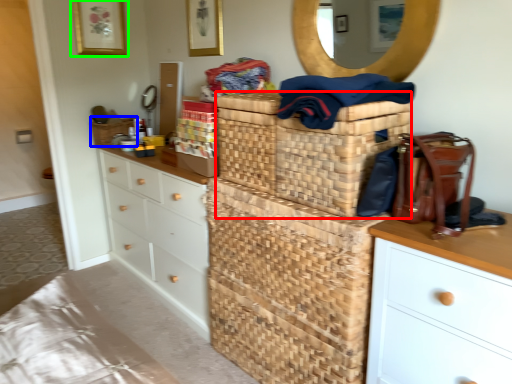
Question: Estimate the real-world distances between objects in this image. Which object is closer to basket (highlighted by a red box), basket (highlighted by a blue box) or picture frame (highlighted by a green box)?

Choices:
 (A) basket
 (B) picture frame

Answer: (A)